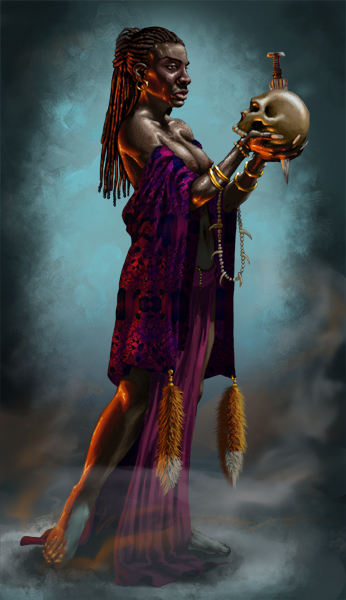
This screenshot has height=600, width=346. In order to click on floor in this screenshot , I will do `click(265, 545)`.